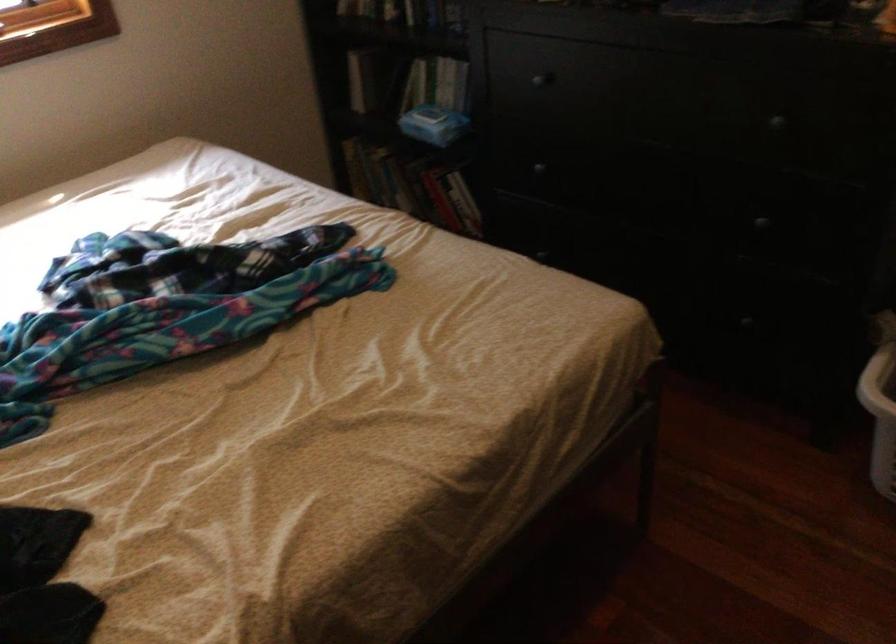
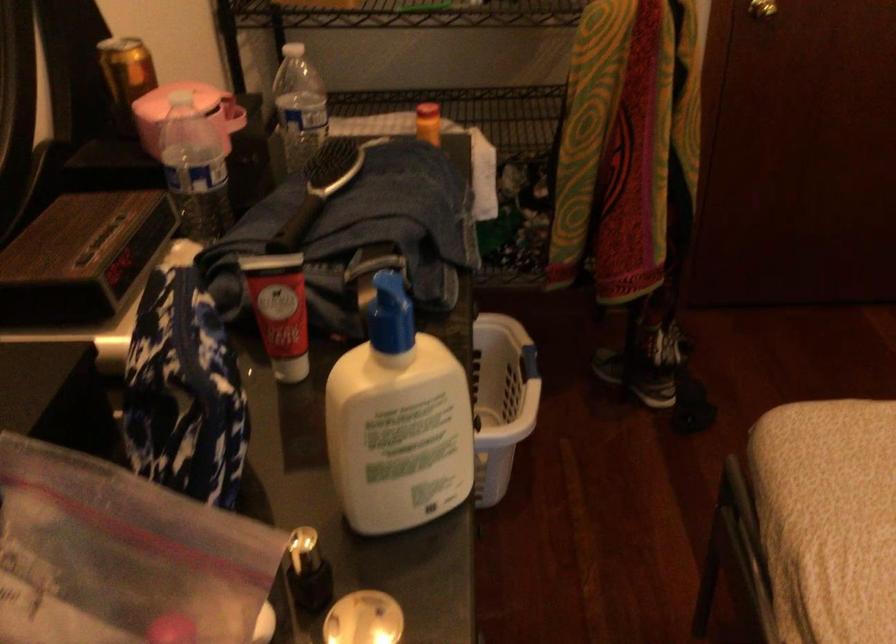
Question: I am providing you with two images of the same scene from different viewpoints. After the viewpoint changes to image2, which objects are now occluded?

Choices:
 (A) white travel mug
 (B) golden aluminum can
 (C) black drawer knob
 (D) red lotion tube

Answer: (C)